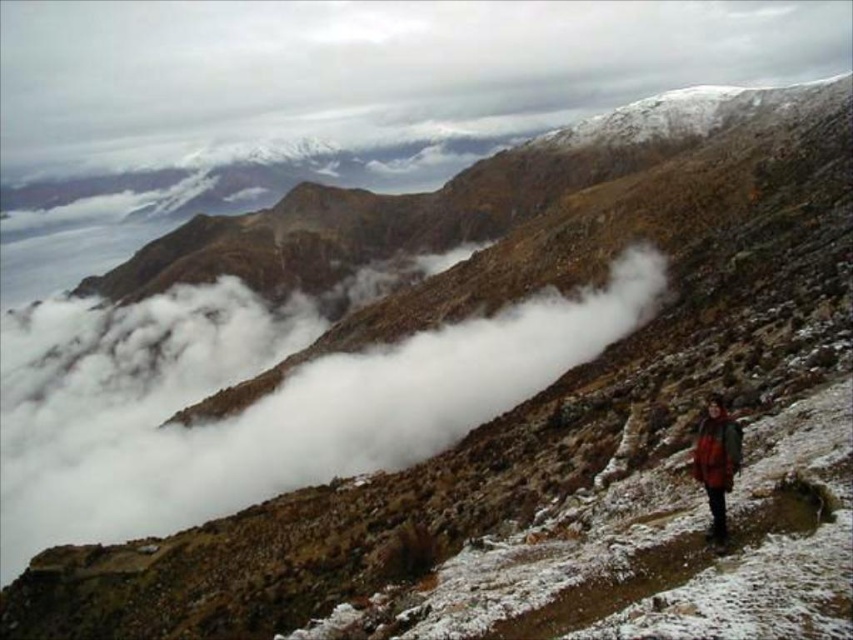
You are a hiker navigating a narrow path in the mountains. You see two points marked on your map. The first point is at coordinate point (132, 163) and the second is at point (715, 449). If you are facing the direction of the path, which point is closer to you?

Point (715, 449) is closer to you because it is in front of point (132, 163), which is behind it.

You are a drone operator trying to capture a photo of the white fluffy cloud at upper center. The drone can only hover at coordinates between 0.1 and 0.2 on the x and y axes. Can the drone capture the cloud?

The white fluffy cloud at upper center is located at point (364, 74). Since the drone can only hover between 0.1 and 0.2 on the x and y axes, the y coordinate of 0.429 exceeds the maximum y limit of 0.2. Therefore, the drone cannot capture the cloud at this position.